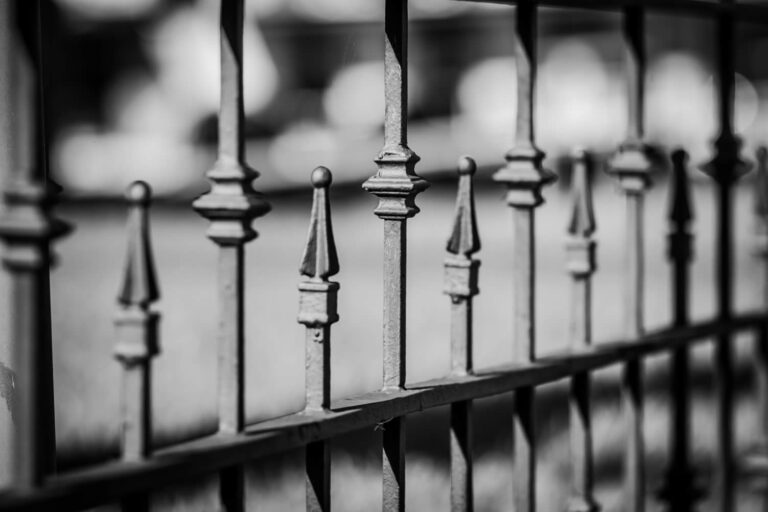
The height and width of the screenshot is (512, 768). I want to click on rod, so click(x=458, y=354).